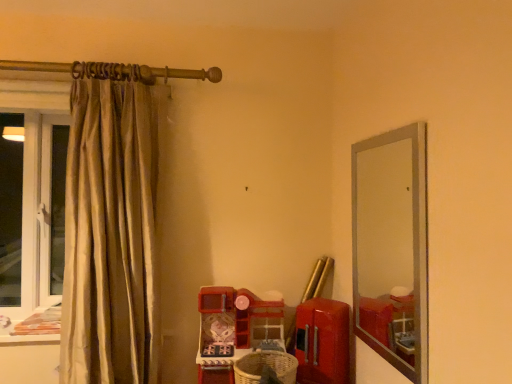
Question: Could you tell me if woven brown basket at lower center is facing silky beige curtain at left?

Choices:
 (A) no
 (B) yes

Answer: (B)

Question: Is woven brown basket at lower center turned away from silky beige curtain at left?

Choices:
 (A) yes
 (B) no

Answer: (B)

Question: From a real-world perspective, is woven brown basket at lower center physically above silky beige curtain at left?

Choices:
 (A) yes
 (B) no

Answer: (B)

Question: From the image's perspective, is woven brown basket at lower center on top of silky beige curtain at left?

Choices:
 (A) no
 (B) yes

Answer: (A)

Question: Can you confirm if woven brown basket at lower center is positioned to the right of silky beige curtain at left?

Choices:
 (A) no
 (B) yes

Answer: (B)

Question: Is point (137, 357) closer or farther from the camera than point (359, 248)?

Choices:
 (A) closer
 (B) farther

Answer: (A)

Question: From a real-world perspective, is silky beige curtain at left positioned above or below clear glass mirror at right?

Choices:
 (A) above
 (B) below

Answer: (A)

Question: From the image's perspective, is silky beige curtain at left located above or below clear glass mirror at right?

Choices:
 (A) below
 (B) above

Answer: (B)

Question: From their relative heights in the image, would you say silky beige curtain at left is taller or shorter than clear glass mirror at right?

Choices:
 (A) short
 (B) tall

Answer: (B)

Question: From the image's perspective, is clear glass mirror at right above or below silky beige curtain at left?

Choices:
 (A) above
 (B) below

Answer: (B)

Question: Is clear glass mirror at right inside or outside of silky beige curtain at left?

Choices:
 (A) inside
 (B) outside

Answer: (B)

Question: Would you say clear glass mirror at right is to the left or to the right of silky beige curtain at left in the picture?

Choices:
 (A) left
 (B) right

Answer: (B)

Question: Considering the positions of clear glass mirror at right and silky beige curtain at left in the image, is clear glass mirror at right wider or thinner than silky beige curtain at left?

Choices:
 (A) wide
 (B) thin

Answer: (B)

Question: Is silky beige curtain at left in front of or behind woven brown basket at lower center in the image?

Choices:
 (A) front
 (B) behind

Answer: (A)

Question: Is silky beige curtain at left wider or thinner than woven brown basket at lower center?

Choices:
 (A) wide
 (B) thin

Answer: (A)